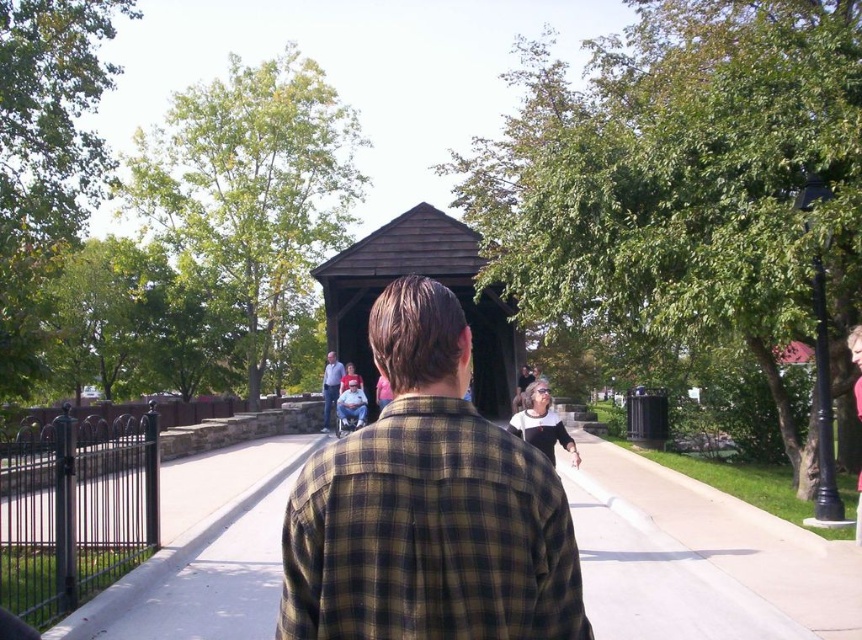
Question: Which of the following is the farthest from the observer?

Choices:
 (A) brown wooden gazebo at center
 (B) plaid shirt at center

Answer: (A)

Question: Is brown wooden gazebo at center behind light blue shirt at center?

Choices:
 (A) no
 (B) yes

Answer: (A)

Question: Can you confirm if plaid shirt at center is positioned to the left of brown wooden gazebo at center?

Choices:
 (A) no
 (B) yes

Answer: (A)

Question: Based on their relative distances, which object is farther from the plaid shirt at center?

Choices:
 (A) brown wooden gazebo at center
 (B) light blue shirt at center

Answer: (A)

Question: Can you confirm if plaid shirt at center is thinner than brown wooden gazebo at center?

Choices:
 (A) no
 (B) yes

Answer: (B)

Question: Based on their relative distances, which object is nearer to the brown wooden gazebo at center?

Choices:
 (A) light blue shirt at center
 (B) plaid shirt at center

Answer: (A)